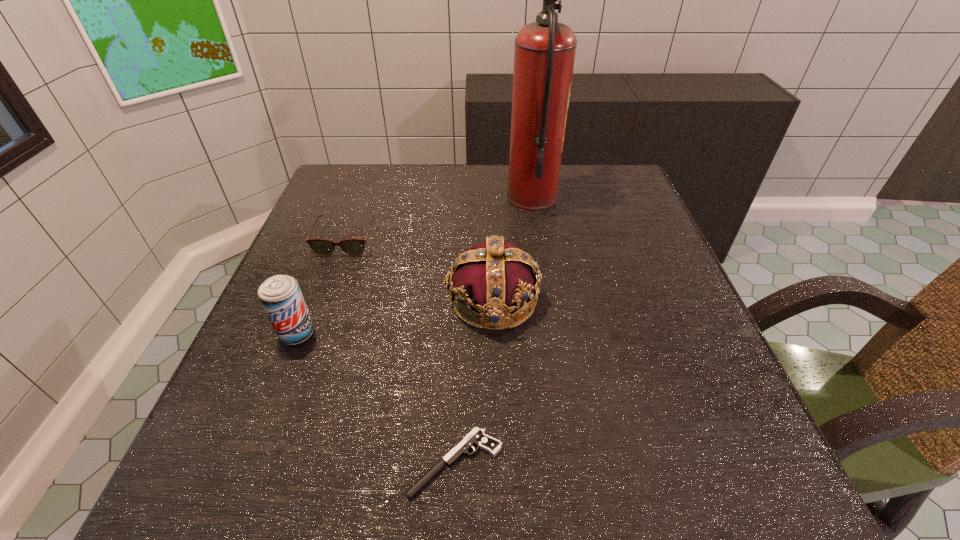
Where is `the farthest object`? Image resolution: width=960 pixels, height=540 pixels. the farthest object is located at coordinates (544, 55).

Where is `fire extinguisher`? This screenshot has width=960, height=540. fire extinguisher is located at coordinates (544, 55).

Identify the location of crown. (494, 278).

The width and height of the screenshot is (960, 540). What are the coordinates of `beer can` in the screenshot? It's located at (280, 295).

You are a GUI agent. You are given a task and a screenshot of the screen. Output one action in this format:
    pyautogui.click(x=<x>, y=<y>)
    Task: Click on the spectacles
    The width and height of the screenshot is (960, 540).
    Given the screenshot: What is the action you would take?
    354,247

Where is `the second shortest object`? the second shortest object is located at coordinates (354, 247).

What are the coordinates of `the nearest object` in the screenshot? It's located at (476, 437).

You are a GUI agent. You are given a task and a screenshot of the screen. Output one action in this format:
    pyautogui.click(x=<x>, y=<y>)
    Task: Click on the pistol
    Image resolution: width=960 pixels, height=540 pixels.
    Given the screenshot: What is the action you would take?
    pyautogui.click(x=476, y=437)

The image size is (960, 540). I want to click on free region located at the nozzle of the farthest object, so click(404, 198).

This screenshot has width=960, height=540. I want to click on free point located 0.140m at the nozzle of the farthest object, so click(453, 198).